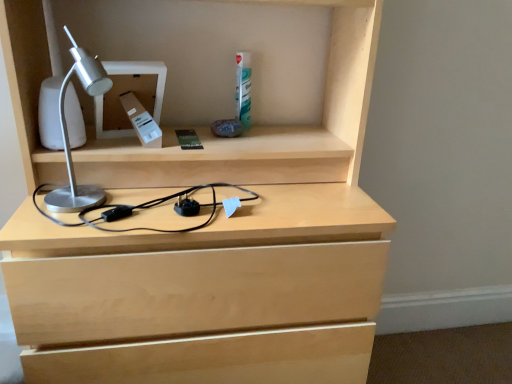
Question: Should I look upward or downward to see silver metallic desk lamp at upper left?

Choices:
 (A) down
 (B) up

Answer: (B)

Question: Does silver metallic desk lamp at upper left turn towards silver metallic desk lamp at left?

Choices:
 (A) yes
 (B) no

Answer: (B)

Question: Is silver metallic desk lamp at upper left thinner than silver metallic desk lamp at left?

Choices:
 (A) yes
 (B) no

Answer: (B)

Question: Would you say silver metallic desk lamp at upper left is a long distance from silver metallic desk lamp at left?

Choices:
 (A) yes
 (B) no

Answer: (B)

Question: Is silver metallic desk lamp at upper left turned away from silver metallic desk lamp at left?

Choices:
 (A) yes
 (B) no

Answer: (B)

Question: Could silver metallic desk lamp at left be considered to be inside silver metallic desk lamp at upper left?

Choices:
 (A) yes
 (B) no

Answer: (B)

Question: Considering the relative sizes of silver metallic desk lamp at upper left and silver metallic desk lamp at left in the image provided, is silver metallic desk lamp at upper left bigger than silver metallic desk lamp at left?

Choices:
 (A) yes
 (B) no

Answer: (B)

Question: Considering the relative sizes of silver metallic desk lamp at left and silver metallic desk lamp at upper left in the image provided, is silver metallic desk lamp at left taller than silver metallic desk lamp at upper left?

Choices:
 (A) yes
 (B) no

Answer: (A)

Question: Is silver metallic desk lamp at left in contact with silver metallic desk lamp at upper left?

Choices:
 (A) no
 (B) yes

Answer: (A)

Question: Is silver metallic desk lamp at left to the right of silver metallic desk lamp at upper left from the viewer's perspective?

Choices:
 (A) no
 (B) yes

Answer: (A)

Question: Can you confirm if silver metallic desk lamp at left is bigger than silver metallic desk lamp at upper left?

Choices:
 (A) yes
 (B) no

Answer: (A)

Question: Is silver metallic desk lamp at left oriented away from silver metallic desk lamp at upper left?

Choices:
 (A) no
 (B) yes

Answer: (B)

Question: Is silver metallic desk lamp at left aimed at silver metallic desk lamp at upper left?

Choices:
 (A) no
 (B) yes

Answer: (A)

Question: Considering the positions of silver metallic desk lamp at left and silver metallic desk lamp at upper left in the image, is silver metallic desk lamp at left wider or thinner than silver metallic desk lamp at upper left?

Choices:
 (A) thin
 (B) wide

Answer: (A)